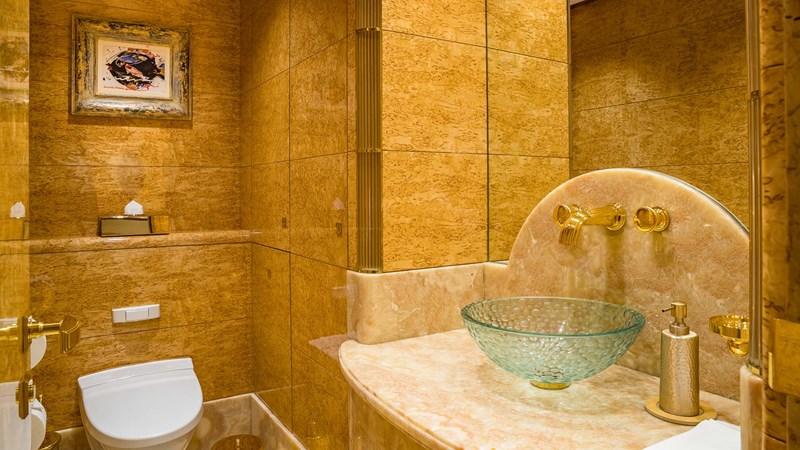
Image resolution: width=800 pixels, height=450 pixels. Find the location of `basin desk`. basin desk is located at coordinates point(450,410).